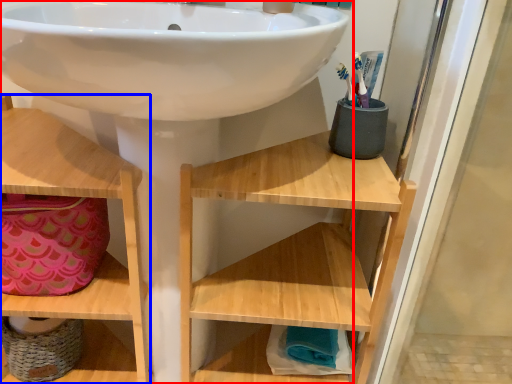
Question: Which object appears farthest to the camera in this image, sink (highlighted by a red box) or shelf (highlighted by a blue box)?

Choices:
 (A) sink
 (B) shelf

Answer: (B)